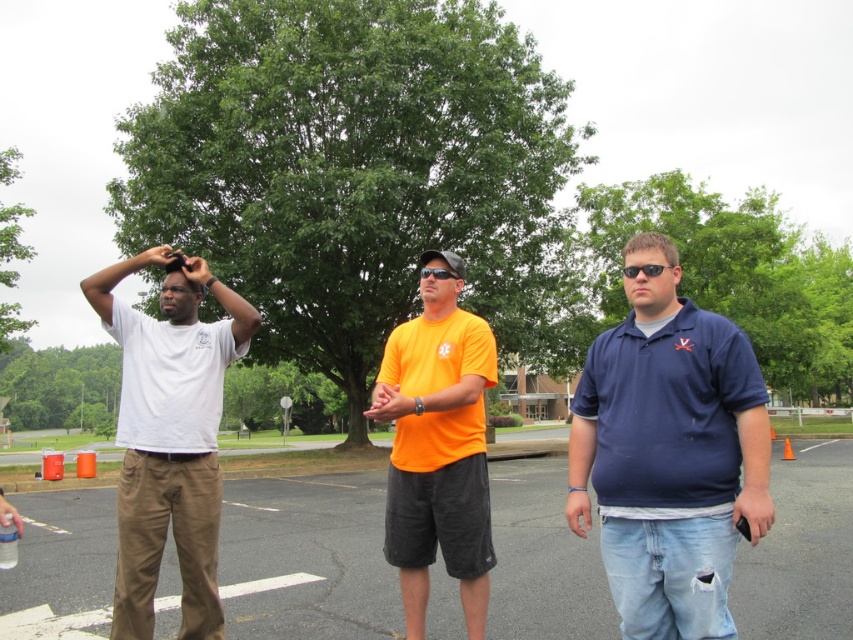
Can you confirm if asphalt at center is taller than white matte t-shirt at left?

Correct, asphalt at center is much taller as white matte t-shirt at left.

Can you confirm if asphalt at center is smaller than white matte t-shirt at left?

No.

Identify the location of asphalt at center. The width and height of the screenshot is (853, 640). (306, 560).

Does navy blue polo shirt at right appear on the left side of orange matte t-shirt at center?

In fact, navy blue polo shirt at right is to the right of orange matte t-shirt at center.

Is navy blue polo shirt at right positioned at the back of orange matte t-shirt at center?

No, navy blue polo shirt at right is closer to the viewer.

Which is behind, point (691, 410) or point (469, 452)?

Positioned behind is point (469, 452).

Find the location of a particular element. The width and height of the screenshot is (853, 640). navy blue polo shirt at right is located at coordinates (669, 454).

Does white matte t-shirt at left have a lesser height compared to orange matte t-shirt at center?

Indeed, white matte t-shirt at left has a lesser height compared to orange matte t-shirt at center.

Between point (160, 244) and point (392, 465), which one is positioned behind?

The point (160, 244) is behind.

The height and width of the screenshot is (640, 853). Identify the location of white matte t-shirt at left. (169, 436).